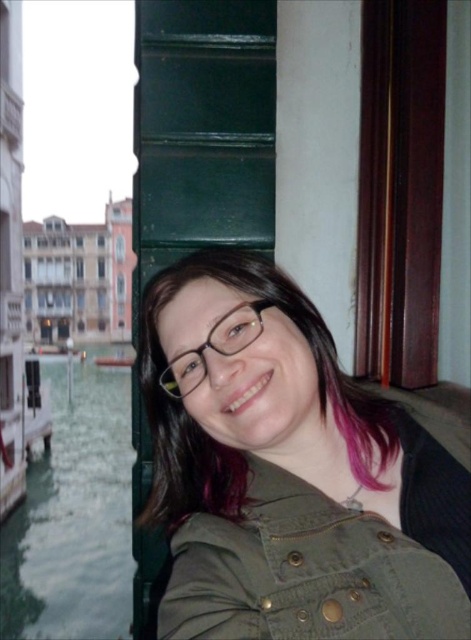
Is green liquid water at lower left smaller than clear plastic glasses at center?

No, green liquid water at lower left is not smaller than clear plastic glasses at center.

Does green liquid water at lower left have a greater width compared to clear plastic glasses at center?

Indeed, green liquid water at lower left has a greater width compared to clear plastic glasses at center.

What do you see at coordinates (73, 515) in the screenshot? I see `green liquid water at lower left` at bounding box center [73, 515].

The height and width of the screenshot is (640, 471). I want to click on green liquid water at lower left, so click(73, 515).

I want to click on matte olive-green jacket at center, so click(x=289, y=472).

Between point (228, 401) and point (248, 304), which one is positioned behind?

The point (248, 304) is behind.

Locate an element on the screen. The width and height of the screenshot is (471, 640). matte olive-green jacket at center is located at coordinates (289, 472).

Is matte olive-green jacket at center closer to the viewer compared to green liquid water at lower left?

Yes, matte olive-green jacket at center is in front of green liquid water at lower left.

Is matte olive-green jacket at center shorter than green liquid water at lower left?

No.

The height and width of the screenshot is (640, 471). Find the location of `matte olive-green jacket at center`. matte olive-green jacket at center is located at coordinates (289, 472).